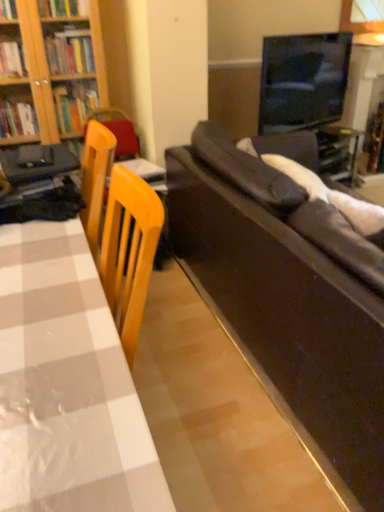
Question: In terms of size, does leather couch at right appear bigger or smaller than white checkered table at left?

Choices:
 (A) small
 (B) big

Answer: (B)

Question: Is leather couch at right spatially inside white checkered table at left, or outside of it?

Choices:
 (A) inside
 (B) outside

Answer: (B)

Question: From a real-world perspective, is leather couch at right above or below white checkered table at left?

Choices:
 (A) above
 (B) below

Answer: (B)

Question: Considering the positions of white checkered table at left and leather couch at right in the image, is white checkered table at left taller or shorter than leather couch at right?

Choices:
 (A) short
 (B) tall

Answer: (B)

Question: From the image's perspective, is white checkered table at left located above or below leather couch at right?

Choices:
 (A) above
 (B) below

Answer: (B)

Question: From a real-world perspective, is white checkered table at left above or below leather couch at right?

Choices:
 (A) above
 (B) below

Answer: (A)

Question: Would you say white checkered table at left is inside or outside leather couch at right?

Choices:
 (A) inside
 (B) outside

Answer: (B)